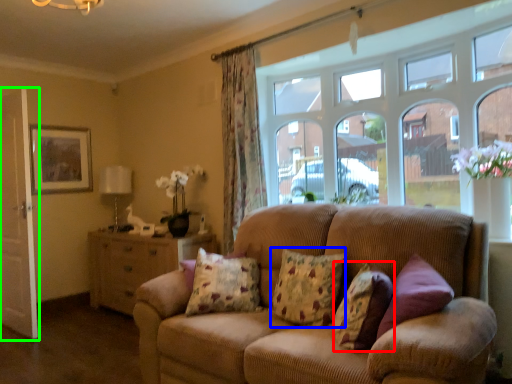
Question: Estimate the real-world distances between objects in this image. Which object is closer to pillow (highlighted by a red box), pillow (highlighted by a blue box) or screen door (highlighted by a green box)?

Choices:
 (A) pillow
 (B) screen door

Answer: (A)